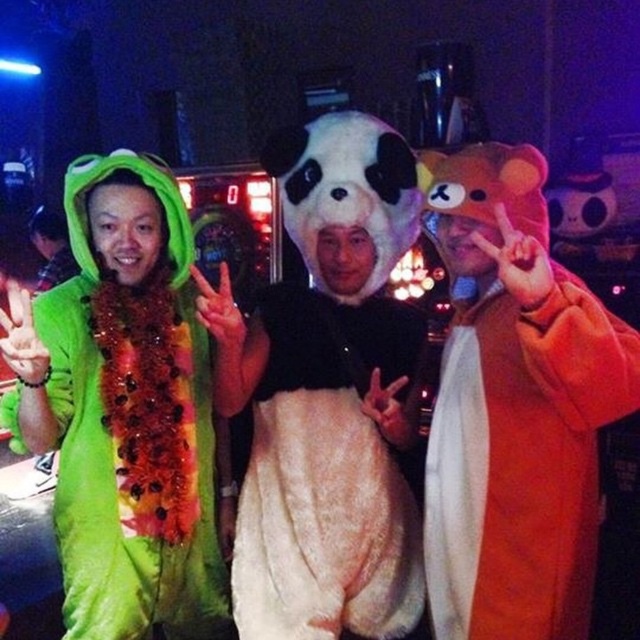
You are a photographer at the event and need to adjust the lighting between the orange plush bear at center and the green fuzzy frog at left. The minimum distance required between the two subjects for proper lighting is 3 feet. Can the current distance accommodate this requirement?

The orange plush bear at center is 30.48 inches away from the green fuzzy frog at left. Since 30.48 inches equals exactly 2.54 feet, which is less than the required 3 feet, the current distance is insufficient for proper lighting.

You are a photographer at the event and want to position a camera to capture the orange plush bear at center. Given the coordinates provided in the Objects Description, can you confirm if the bear is positioned closer to the right side of the image compared to the other elements?

The orange plush bear at center is located at point 0.636 on the x and 0.805 on the y. Since the x coordinate is 0.636, which is more than halfway across the image, the bear is indeed positioned closer to the right side of the image compared to elements with lower x coordinates.

You are at a party and want to take a photo with the green fuzzy frog at left and the fuzzy white dress at center. Which one is positioned more to the right side of the photo?

The fuzzy white dress at center is positioned more to the right side of the photo than the green fuzzy frog at left.